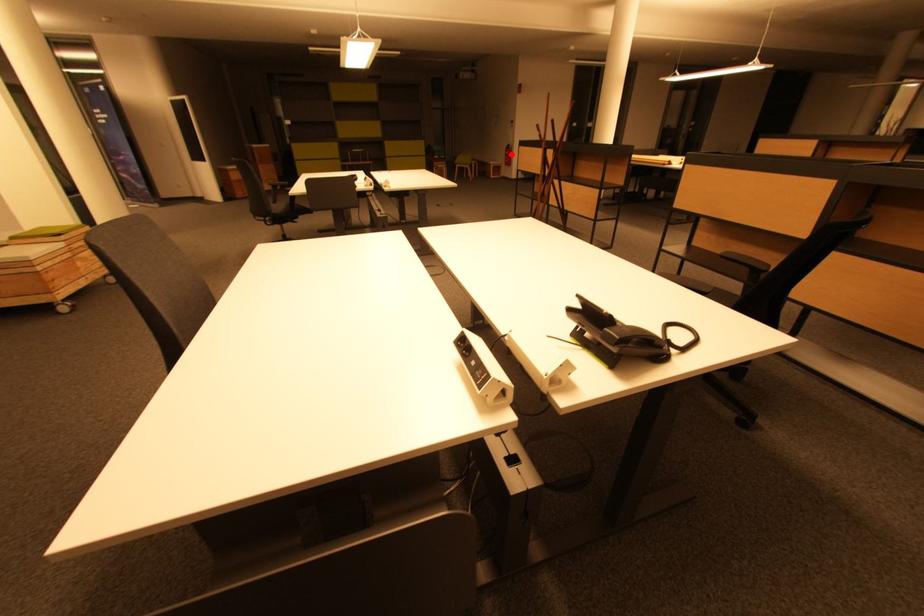
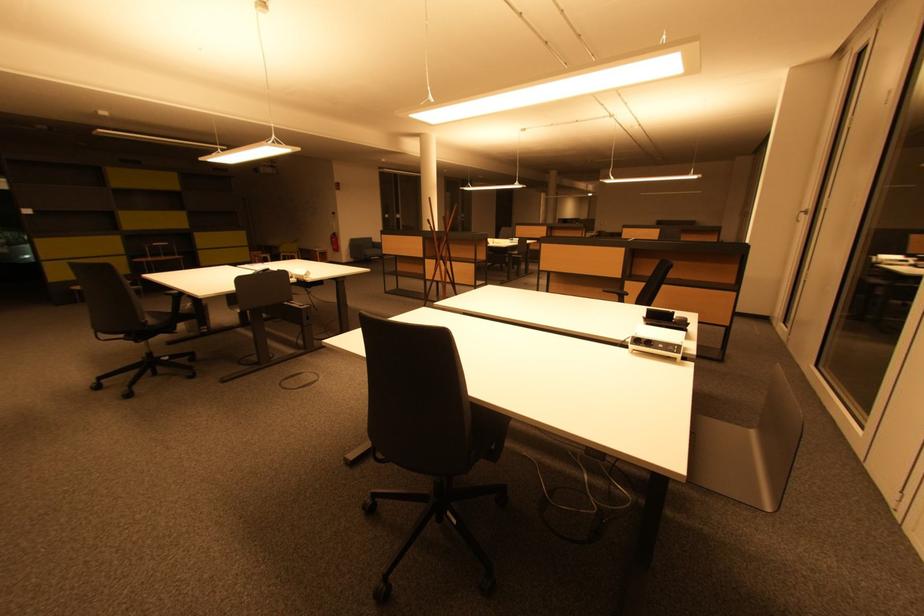
Locate, in the second image, the point that corresponds to the highlighted location in the first image.

(338, 241)